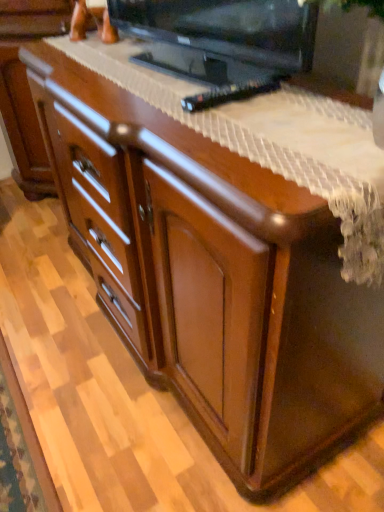
I want to click on vacant space that is in between black glossy television at upper center and black plastic remote at center, so click(x=179, y=89).